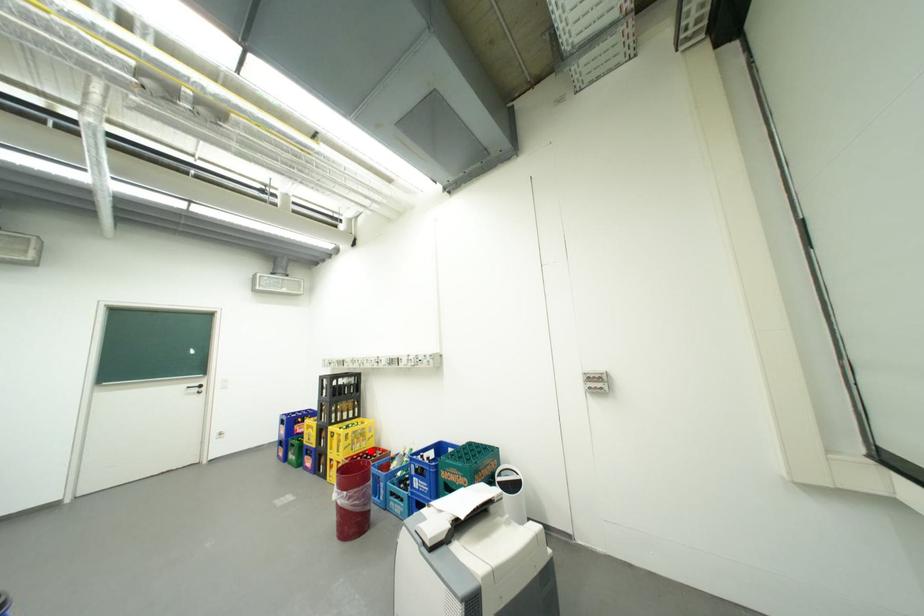
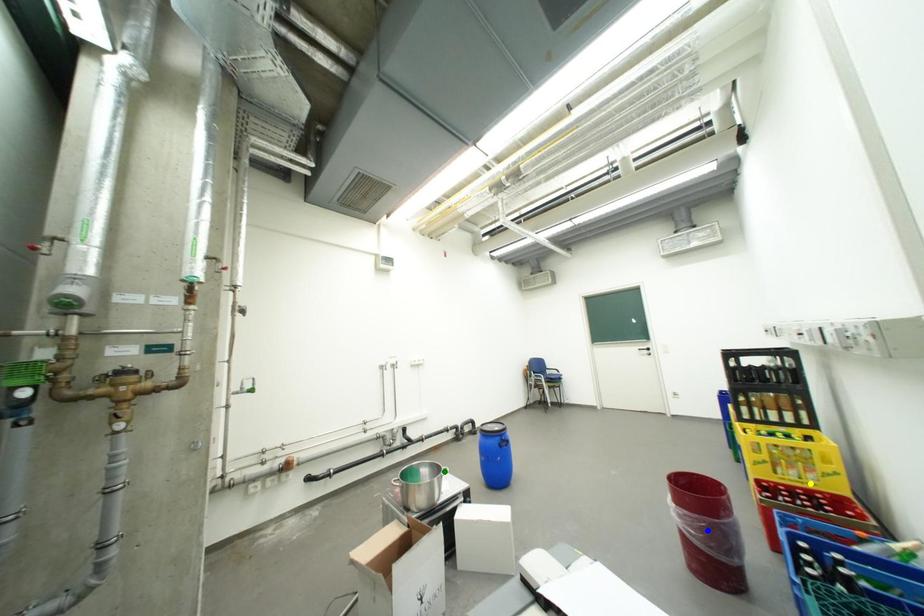
Question: I am providing you with two images of the same scene from different viewpoints. A red point is marked on the first image. You are given multiple points on the second image. Which point in image 2 represents the same 3d spot as the red point in image 1?

Choices:
 (A) yellow point
 (B) blue point
 (C) green point

Answer: (A)